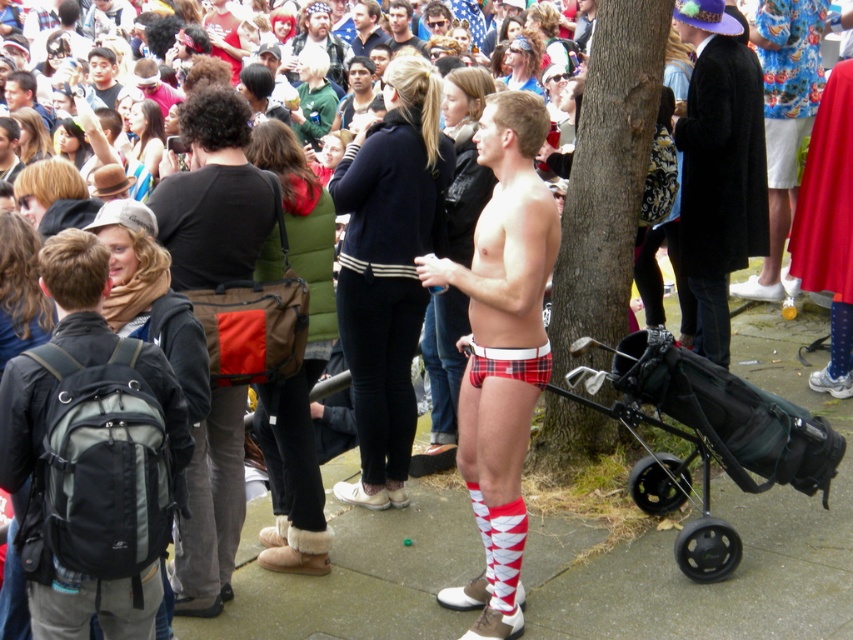
Is black textured golf bag at lower right thinner than matte black coat at center?

No.

Does black textured golf bag at lower right come in front of matte black coat at center?

That is True.

Is point (815, 422) farther from camera compared to point (698, 301)?

No, (815, 422) is closer to viewer.

I want to click on black textured golf bag at lower right, so click(x=705, y=436).

Is brown textured tree trunk at center smaller than beige fabric hat at upper center?

Incorrect, brown textured tree trunk at center is not smaller in size than beige fabric hat at upper center.

Can you confirm if brown textured tree trunk at center is taller than beige fabric hat at upper center?

Yes, brown textured tree trunk at center is taller than beige fabric hat at upper center.

This screenshot has height=640, width=853. I want to click on brown textured tree trunk at center, so click(x=607, y=173).

Is plaid fabric shorts at center to the right of beige fabric hat at upper center from the viewer's perspective?

Indeed, plaid fabric shorts at center is positioned on the right side of beige fabric hat at upper center.

Which is below, plaid fabric shorts at center or beige fabric hat at upper center?

plaid fabric shorts at center is lower down.

Is point (500, 547) farther from viewer compared to point (328, 17)?

No, it is in front of (328, 17).

Where is `plaid fabric shorts at center`? plaid fabric shorts at center is located at coordinates (502, 349).